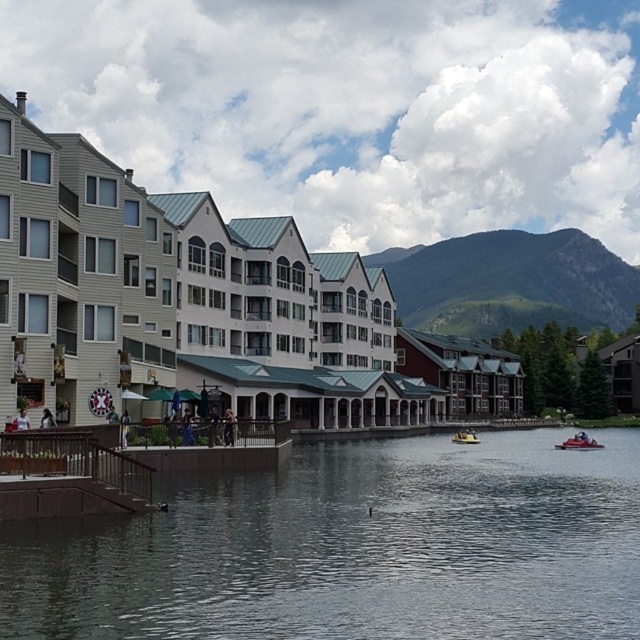
Can you confirm if beige siding building at center is positioned below metallic red speedboat at lower right?

Actually, beige siding building at center is above metallic red speedboat at lower right.

This screenshot has height=640, width=640. Identify the location of beige siding building at center. (208, 307).

You are a GUI agent. You are given a task and a screenshot of the screen. Output one action in this format:
    pyautogui.click(x=<x>, y=<y>)
    Task: Click on the beige siding building at center
    The height and width of the screenshot is (640, 640).
    Given the screenshot: What is the action you would take?
    pyautogui.click(x=208, y=307)

Is transparent water at center closer to the viewer compared to beige siding building at center?

That is True.

What do you see at coordinates (353, 548) in the screenshot? I see `transparent water at center` at bounding box center [353, 548].

Which is behind, point (1, 625) or point (481, 355)?

Positioned behind is point (481, 355).

Image resolution: width=640 pixels, height=640 pixels. In order to click on transparent water at center in this screenshot , I will do `click(353, 548)`.

Does brown wooden dock at lower left have a greater width compared to yellow plastic boat at lower center?

Indeed, brown wooden dock at lower left has a greater width compared to yellow plastic boat at lower center.

Does point (83, 506) come in front of point (454, 433)?

Yes, it is in front of point (454, 433).

Is point (24, 483) behind point (467, 442)?

No, (24, 483) is closer to viewer.

Where is `brown wooden dock at lower left`? The width and height of the screenshot is (640, 640). brown wooden dock at lower left is located at coordinates (68, 476).